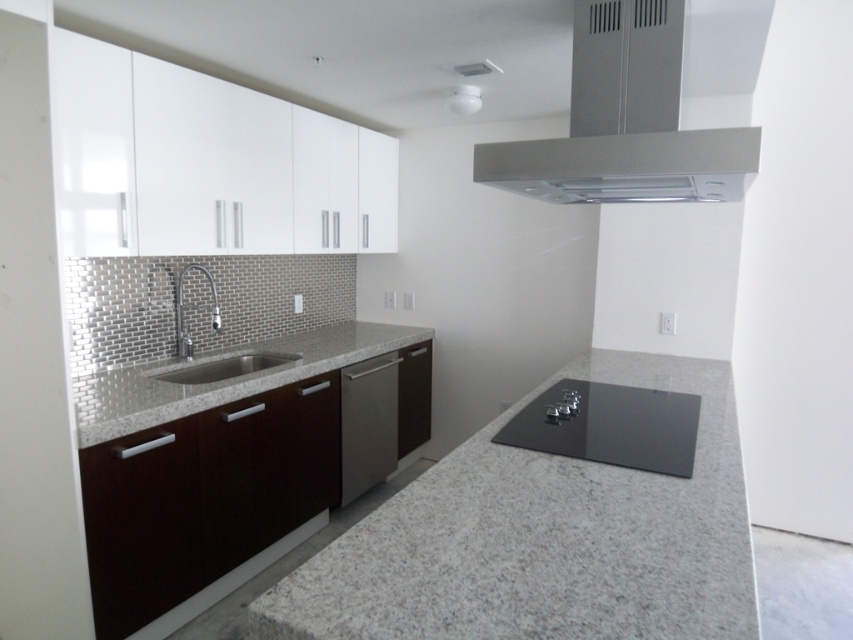
You are a kitchen designer assessing the layout of this modern kitchen. You notice the gray granite countertop at left and the satin silver sink at center. Which object is positioned higher in elevation?

The gray granite countertop at left is much taller than the satin silver sink at center, so it is positioned higher in elevation.

In the scene shown: You are a kitchen designer planning to place a new appliance in the kitchen. The appliance requires a specific coordinate point for installation. According to the image, where exactly is the granite at center located?

The granite at center is located at the coordinate point of 0.844 on the x axis and 0.639 on the y axis.

You are standing in the kitchen and want to place a cutting board on the granite at center. However, there is a pot on the black glass cooktop at center. Can you place the cutting board directly in front of the pot without moving it?

Yes, because the granite at center is in front of the black glass cooktop at center, so placing the cutting board there would be directly in front of the pot without needing to move it.